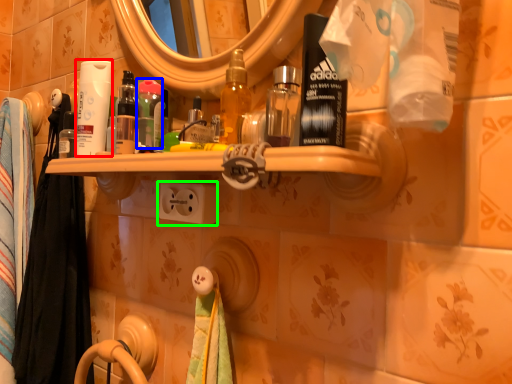
Question: Which object is the closest to the toilet paper (highlighted by a red box)? Choose among these: mouthwash (highlighted by a blue box) or electric outlet (highlighted by a green box).

Choices:
 (A) mouthwash
 (B) electric outlet

Answer: (A)